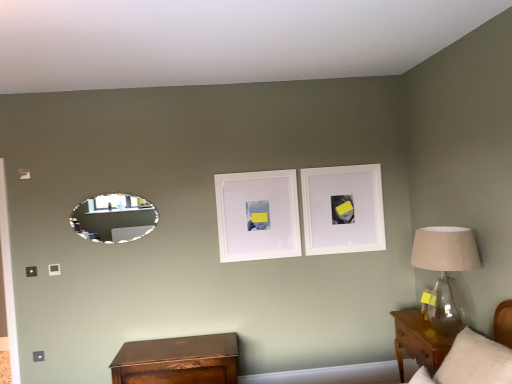
Question: Does white matte picture frame at upper center, the 2th picture frame viewed from the left, turn towards brown wood nightstand at lower right, which ranks as the second nightstand in left-to-right order?

Choices:
 (A) yes
 (B) no

Answer: (B)

Question: Does white matte picture frame at upper center, which is the 1th picture frame from right to left, have a lesser width compared to brown wood nightstand at lower right, which is the 1th nightstand in right-to-left order?

Choices:
 (A) no
 (B) yes

Answer: (B)

Question: Is white matte picture frame at upper center, which is the 1th picture frame from right to left, outside brown wood nightstand at lower right, which ranks as the second nightstand in left-to-right order?

Choices:
 (A) no
 (B) yes

Answer: (B)

Question: Is white matte picture frame at upper center, which is the 1th picture frame from right to left, positioned in front of brown wood nightstand at lower right, which is the 1th nightstand in right-to-left order?

Choices:
 (A) no
 (B) yes

Answer: (A)

Question: From the image's perspective, does white matte picture frame at upper center, which is the 1th picture frame from right to left, appear lower than brown wood nightstand at lower right, which ranks as the second nightstand in left-to-right order?

Choices:
 (A) yes
 (B) no

Answer: (B)

Question: Is clear glass lampshade at right to the left or to the right of oval silver mirror at left in the image?

Choices:
 (A) left
 (B) right

Answer: (B)

Question: Is clear glass lampshade at right situated inside oval silver mirror at left or outside?

Choices:
 (A) inside
 (B) outside

Answer: (B)

Question: In the image, is clear glass lampshade at right positioned in front of or behind oval silver mirror at left?

Choices:
 (A) behind
 (B) front

Answer: (B)

Question: From a real-world perspective, relative to oval silver mirror at left, is clear glass lampshade at right vertically above or below?

Choices:
 (A) above
 (B) below

Answer: (B)

Question: Considering the positions of brown wood nightstand at lower right, which is the 1th nightstand in right-to-left order, and white matte picture frame at upper center, the 2th picture frame viewed from the left, in the image, is brown wood nightstand at lower right, which is the 1th nightstand in right-to-left order, bigger or smaller than white matte picture frame at upper center, the 2th picture frame viewed from the left,?

Choices:
 (A) big
 (B) small

Answer: (A)

Question: In the image, is brown wood nightstand at lower right, which is the 1th nightstand in right-to-left order, positioned in front of or behind white matte picture frame at upper center, which is the 1th picture frame from right to left?

Choices:
 (A) behind
 (B) front

Answer: (B)

Question: From a real-world perspective, is brown wood nightstand at lower right, which ranks as the second nightstand in left-to-right order, positioned above or below white matte picture frame at upper center, which is the 1th picture frame from right to left?

Choices:
 (A) below
 (B) above

Answer: (A)

Question: Is brown wood nightstand at lower right, which ranks as the second nightstand in left-to-right order, situated inside white matte picture frame at upper center, the 2th picture frame viewed from the left, or outside?

Choices:
 (A) outside
 (B) inside

Answer: (A)

Question: Looking at the image, does white matte picture frame at center, the 2th picture frame when ordered from right to left, seem bigger or smaller compared to brown wood nightstand at lower right, which is the 1th nightstand in right-to-left order?

Choices:
 (A) small
 (B) big

Answer: (A)

Question: Considering their positions, is white matte picture frame at center, the 2th picture frame when ordered from right to left, located in front of or behind brown wood nightstand at lower right, which is the 1th nightstand in right-to-left order?

Choices:
 (A) behind
 (B) front

Answer: (A)